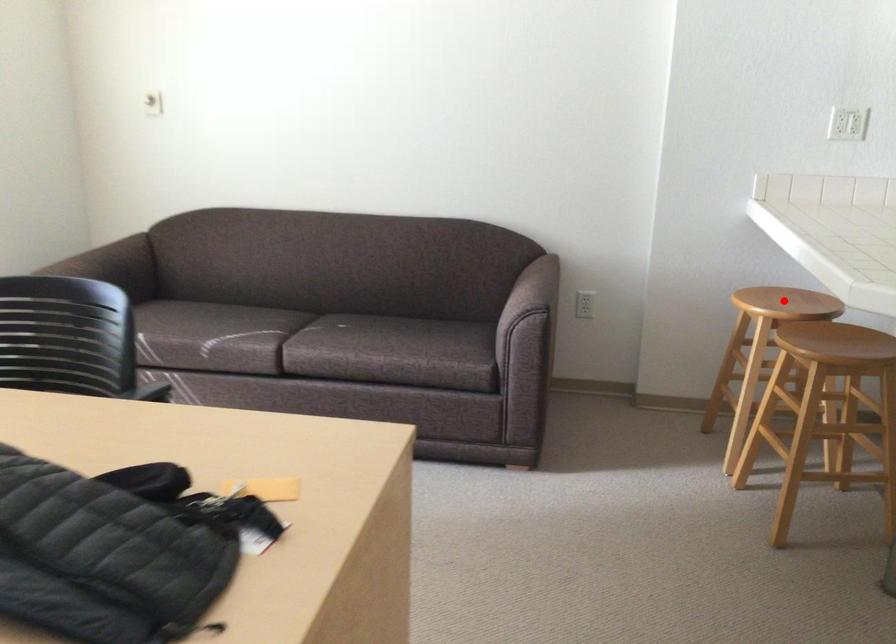
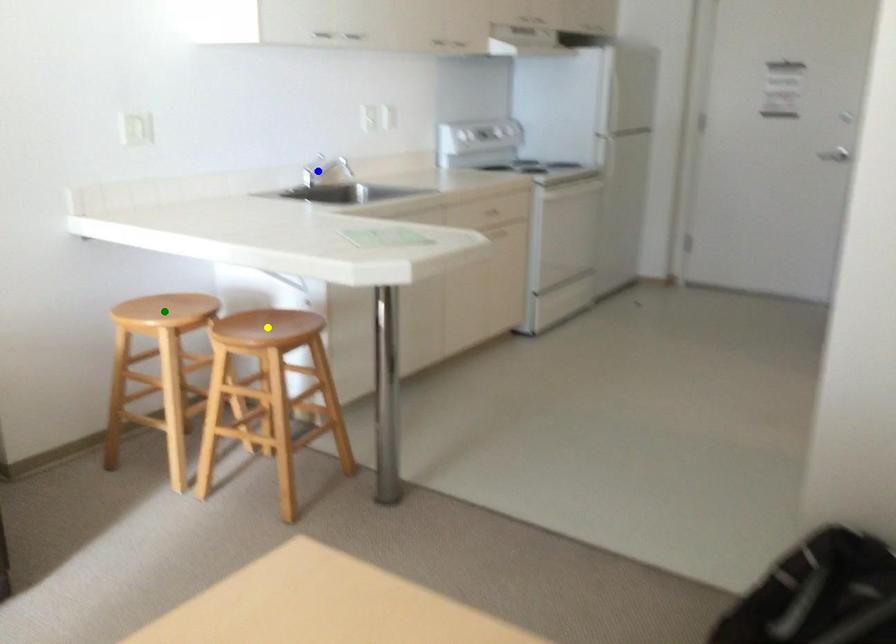
Question: I am providing you with two images of the same scene from different viewpoints. A red point is marked on the first image. You are given multiple points on the second image. Which point in image 2 represents the same 3d spot as the red point in image 1?

Choices:
 (A) blue point
 (B) yellow point
 (C) green point

Answer: (C)